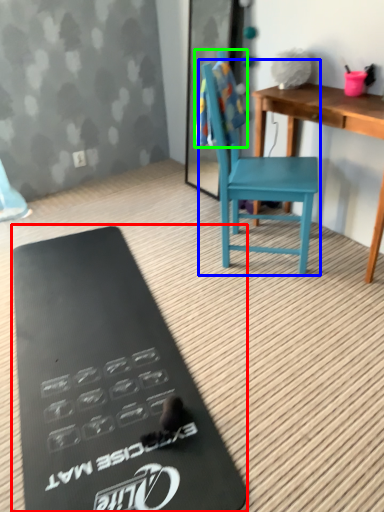
Question: Considering the real-world distances, which object is farthest from clipboard (highlighted by a red box)? armchair (highlighted by a blue box) or towel/napkin (highlighted by a green box)?

Choices:
 (A) armchair
 (B) towel/napkin

Answer: (B)